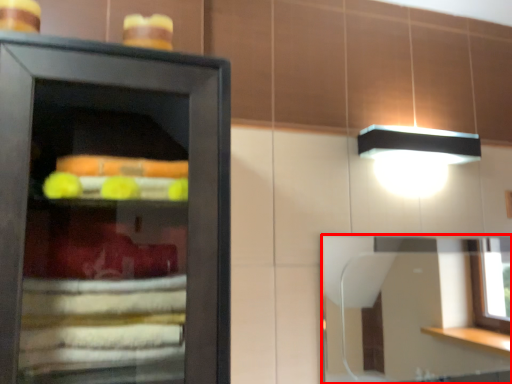
Question: From the image's perspective, what is the correct spatial relationship of mirror (annotated by the red box) in relation to food?

Choices:
 (A) below
 (B) above

Answer: (A)